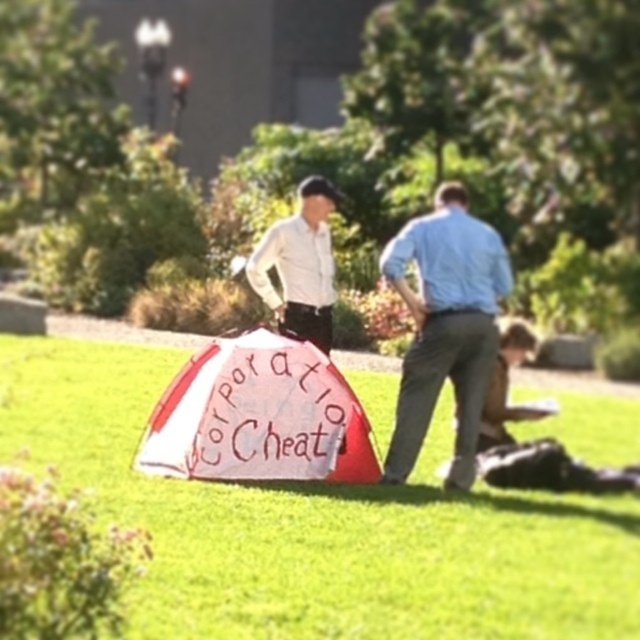
Is the position of light blue cotton shirt at right more distant than that of white glossy shirt at center?

No.

Does point (387, 460) lie in front of point (308, 268)?

Yes, it is.

Locate an element on the screen. This screenshot has width=640, height=640. light blue cotton shirt at right is located at coordinates (445, 326).

What do you see at coordinates (316, 525) in the screenshot? The image size is (640, 640). I see `green grass at center` at bounding box center [316, 525].

Is point (497, 621) more distant than point (310, 284)?

No, (497, 621) is in front of (310, 284).

Find the location of a particular element. Image resolution: width=640 pixels, height=640 pixels. green grass at center is located at coordinates (316, 525).

Does green grass at center have a larger size compared to light blue cotton shirt at right?

Indeed, green grass at center has a larger size compared to light blue cotton shirt at right.

How distant is green grass at center from light blue cotton shirt at right?

green grass at center and light blue cotton shirt at right are 7.90 feet apart from each other.

Where is `green grass at center`? This screenshot has width=640, height=640. green grass at center is located at coordinates (316, 525).